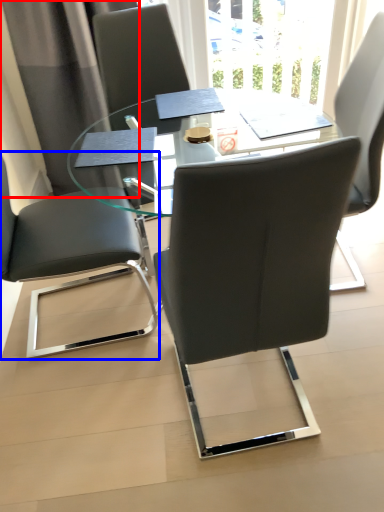
Question: Which object is closer to the camera taking this photo, curtain (highlighted by a red box) or chair (highlighted by a blue box)?

Choices:
 (A) curtain
 (B) chair

Answer: (B)